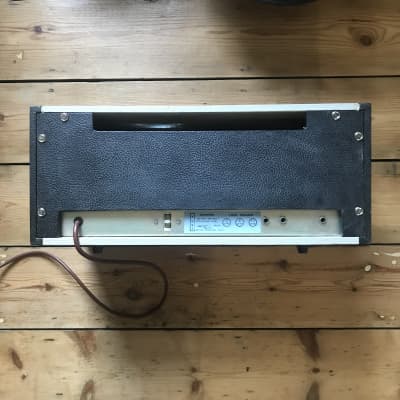
You are a GUI agent. You are given a task and a screenshot of the screen. Output one action in this format:
    pyautogui.click(x=<x>, y=<y>)
    Task: Click on the wood planks
    
    Given the screenshot: What is the action you would take?
    pyautogui.click(x=360, y=365), pyautogui.click(x=329, y=300), pyautogui.click(x=379, y=198), pyautogui.click(x=380, y=130), pyautogui.click(x=308, y=30)